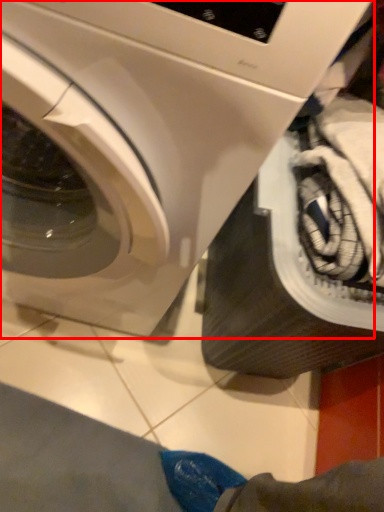
Question: From the image's perspective, what is the correct spatial relationship of washing machine (annotated by the red box) in relation to tire?

Choices:
 (A) below
 (B) above

Answer: (B)